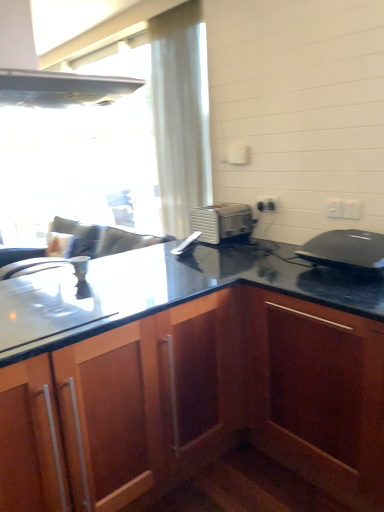
Find the location of a particular element. white plastic electric outlet at upper right, the first electric outlet in the back-to-front sequence is located at coordinates (266, 205).

Measure the distance between white plastic toaster at center and camera.

A distance of 2.37 meters exists between white plastic toaster at center and camera.

Describe the element at coordinates (202, 410) in the screenshot. The width and height of the screenshot is (384, 512). I see `wooden cabinet at lower left` at that location.

This screenshot has width=384, height=512. What do you see at coordinates (334, 208) in the screenshot? I see `white plastic electric outlet at upper right, which appears as the second electric outlet when viewed from the back` at bounding box center [334, 208].

Find the location of `white plastic electric outlet at upper right, positioned as the first electric outlet in right-to-left order`. white plastic electric outlet at upper right, positioned as the first electric outlet in right-to-left order is located at coordinates (351, 210).

Describe the element at coordinates (351, 210) in the screenshot. I see `white plastic electric outlet at upper right, acting as the third electric outlet starting from the back` at that location.

You are a GUI agent. You are given a task and a screenshot of the screen. Output one action in this format:
    pyautogui.click(x=<x>, y=<y>)
    Task: Click on the black matte laptop at upper right
    Image resolution: width=384 pixels, height=512 pixels.
    Given the screenshot: What is the action you would take?
    pyautogui.click(x=346, y=251)

What do you see at coordinates (181, 113) in the screenshot? I see `white sheer curtain at upper left` at bounding box center [181, 113].

I want to click on white sheer curtain at upper left, so click(181, 113).

Identify the location of white plastic electric outlet at upper right, the 1th electric outlet positioned from the left. This screenshot has width=384, height=512. (266, 205).

Does black matte laptop at upper right have a lesser width compared to wooden cabinet at lower left?

Yes.

From a real-world perspective, is black matte laptop at upper right above or below wooden cabinet at lower left?

black matte laptop at upper right is above wooden cabinet at lower left.

Consider the image. Which is more to the left, black matte laptop at upper right or wooden cabinet at lower left?

wooden cabinet at lower left.

Which is closer, (378, 255) or (138, 391)?

Clearly, point (378, 255) is more distant from the camera than point (138, 391).

Is wooden cabinet at lower left not within black matte laptop at upper right?

Yes, wooden cabinet at lower left is located beyond the bounds of black matte laptop at upper right.

Is wooden cabinet at lower left not close to black matte laptop at upper right?

No.

Does point (363, 406) come closer to viewer compared to point (319, 242)?

Yes, point (363, 406) is in front of point (319, 242).

From the image's perspective, which is above, white plastic electric outlet at upper right, the 1th electric outlet from the front, or white plastic electric outlet at upper right, the 1th electric outlet positioned from the left?

white plastic electric outlet at upper right, the 1th electric outlet positioned from the left.

Considering the relative sizes of white plastic electric outlet at upper right, the 1th electric outlet from the front, and white plastic electric outlet at upper right, the first electric outlet in the back-to-front sequence, in the image provided, is white plastic electric outlet at upper right, the 1th electric outlet from the front, smaller than white plastic electric outlet at upper right, the first electric outlet in the back-to-front sequence,?

Yes, white plastic electric outlet at upper right, the 1th electric outlet from the front, is smaller than white plastic electric outlet at upper right, the first electric outlet in the back-to-front sequence.

Considering the relative sizes of white plastic electric outlet at upper right, which appears as the 3th electric outlet when viewed from the left, and white plastic electric outlet at upper right, placed as the 3th electric outlet when sorted from right to left, in the image provided, is white plastic electric outlet at upper right, which appears as the 3th electric outlet when viewed from the left, wider than white plastic electric outlet at upper right, placed as the 3th electric outlet when sorted from right to left,?

Indeed, white plastic electric outlet at upper right, which appears as the 3th electric outlet when viewed from the left, has a greater width compared to white plastic electric outlet at upper right, placed as the 3th electric outlet when sorted from right to left.

Is white plastic electric outlet at upper right, acting as the 2th electric outlet starting from the left, at the back of white plastic electric outlet at upper right, the 1th electric outlet positioned from the left?

No.

Based on the photo, from the image's perspective, which one is positioned higher, white plastic electric outlet at upper right, the first electric outlet in the back-to-front sequence, or white plastic electric outlet at upper right, which appears as the 2th electric outlet when viewed from the front?

white plastic electric outlet at upper right, the first electric outlet in the back-to-front sequence, appears higher in the image.

Between white plastic electric outlet at upper right, the first electric outlet in the back-to-front sequence, and white plastic electric outlet at upper right, which ranks as the 2th electric outlet in right-to-left order, which one is positioned behind?

white plastic electric outlet at upper right, the first electric outlet in the back-to-front sequence, is further from the camera.

Which is in front, point (267, 207) or point (340, 205)?

The point (340, 205) is closer.

Considering the relative sizes of white plastic electric outlet at upper right, positioned as the first electric outlet in right-to-left order, and wooden cabinet at lower left in the image provided, is white plastic electric outlet at upper right, positioned as the first electric outlet in right-to-left order, thinner than wooden cabinet at lower left?

Yes, white plastic electric outlet at upper right, positioned as the first electric outlet in right-to-left order, is thinner than wooden cabinet at lower left.

Which electric outlet is the 1st one when counting from the back of the wooden cabinet at lower left? Please provide its 2D coordinates.

[(351, 210)]

Consider the image. Which is nearer, (x=353, y=219) or (x=232, y=504)?

Point (x=353, y=219) is positioned farther from the camera compared to point (x=232, y=504).

From a real-world perspective, which object rests below the other?

wooden cabinet at lower left is physically lower.

Is wooden cabinet at lower left at the right side of white plastic electric outlet at upper right, which appears as the 3th electric outlet when viewed from the left?

Incorrect, wooden cabinet at lower left is not on the right side of white plastic electric outlet at upper right, which appears as the 3th electric outlet when viewed from the left.

Who is shorter, wooden cabinet at lower left or white plastic electric outlet at upper right, which appears as the 3th electric outlet when viewed from the left?

white plastic electric outlet at upper right, which appears as the 3th electric outlet when viewed from the left, is shorter.

Can you tell me how much wooden cabinet at lower left and white plastic electric outlet at upper right, the 1th electric outlet from the front, differ in facing direction?

90.7 degrees separate the facing orientations of wooden cabinet at lower left and white plastic electric outlet at upper right, the 1th electric outlet from the front.

From a real-world perspective, which object rests below the other?

wooden cabinet at lower left.

How many degrees apart are the facing directions of black matte laptop at upper right and white plastic toaster at center?

The facing directions of black matte laptop at upper right and white plastic toaster at center are 89.8 degrees apart.

From the image's perspective, is black matte laptop at upper right under white plastic toaster at center?

Yes, from the image's perspective, black matte laptop at upper right is below white plastic toaster at center.

Is point (310, 243) closer to camera compared to point (192, 220)?

That is True.

Is black matte laptop at upper right not close to white plastic toaster at center?

No, black matte laptop at upper right is in close proximity to white plastic toaster at center.

This screenshot has height=512, width=384. Find the location of `cabinetry located in front of the black matte laptop at upper right`. cabinetry located in front of the black matte laptop at upper right is located at coordinates (202, 410).

Find the location of a particular element. kitchen appliance lying above the wooden cabinet at lower left (from the image's perspective) is located at coordinates (346, 251).

When comparing their distances from white plastic electric outlet at upper right, which ranks as the 2th electric outlet in right-to-left order, does black matte laptop at upper right or white plastic toaster at center seem further?

white plastic toaster at center lies further to white plastic electric outlet at upper right, which ranks as the 2th electric outlet in right-to-left order, than the other object.

Looking at the image, which one is located closer to white plastic electric outlet at upper right, the 1th electric outlet from the front, white sheer curtain at upper left or wooden cabinet at lower left?

Among the two, wooden cabinet at lower left is located nearer to white plastic electric outlet at upper right, the 1th electric outlet from the front.

In the scene shown: Based on their spatial positions, is white plastic electric outlet at upper right, acting as the third electric outlet starting from the back, or white plastic toaster at center closer to white plastic electric outlet at upper right, acting as the 3th electric outlet starting from the front?

Among the two, white plastic toaster at center is located nearer to white plastic electric outlet at upper right, acting as the 3th electric outlet starting from the front.

From the image, which object appears to be nearer to wooden cabinet at lower left, white plastic electric outlet at upper right, which ranks as the 2th electric outlet in right-to-left order, or black matte laptop at upper right?

black matte laptop at upper right.

When comparing their distances from black matte laptop at upper right, does white plastic electric outlet at upper right, the 1th electric outlet from the front, or wooden cabinet at lower left seem closer?

white plastic electric outlet at upper right, the 1th electric outlet from the front, lies closer to black matte laptop at upper right than the other object.

Considering their positions, is white plastic toaster at center positioned closer to white sheer curtain at upper left than white plastic electric outlet at upper right, acting as the 3th electric outlet starting from the front?

Among the two, white plastic toaster at center is located nearer to white sheer curtain at upper left.

From the image, which object appears to be nearer to black matte laptop at upper right, white sheer curtain at upper left or white plastic electric outlet at upper right, acting as the third electric outlet starting from the back?

Among the two, white plastic electric outlet at upper right, acting as the third electric outlet starting from the back, is located nearer to black matte laptop at upper right.

When comparing their distances from white plastic electric outlet at upper right, placed as the 3th electric outlet when sorted from right to left, does white sheer curtain at upper left or wooden cabinet at lower left seem closer?

white sheer curtain at upper left lies closer to white plastic electric outlet at upper right, placed as the 3th electric outlet when sorted from right to left, than the other object.

You are a GUI agent. You are given a task and a screenshot of the screen. Output one action in this format:
    pyautogui.click(x=<x>, y=<y>)
    Task: Click on the kitchen appliance between wooden cabinet at lower left and white sheer curtain at upper left in the front-back direction
    
    Given the screenshot: What is the action you would take?
    click(x=346, y=251)

Find the location of a particular element. Image resolution: width=384 pixels, height=512 pixels. toaster located between white sheer curtain at upper left and white plastic electric outlet at upper right, the 1th electric outlet from the front, in the left-right direction is located at coordinates (222, 222).

Locate an element on the screen. The image size is (384, 512). electric outlet between white plastic toaster at center and white plastic electric outlet at upper right, which appears as the second electric outlet when viewed from the back, from left to right is located at coordinates (266, 205).

The width and height of the screenshot is (384, 512). What are the coordinates of `toaster between wooden cabinet at lower left and white plastic electric outlet at upper right, positioned as the first electric outlet in right-to-left order, from left to right` in the screenshot? It's located at (222, 222).